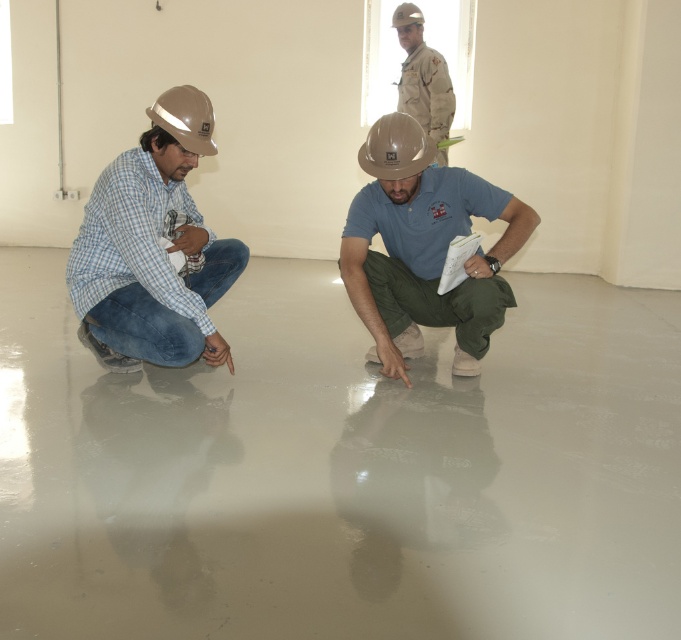
Question: Is matte blue shirt at left below camouflage uniform at upper center?

Choices:
 (A) no
 (B) yes

Answer: (B)

Question: Is matte brown helmet at center above matte beige helmet at upper center?

Choices:
 (A) yes
 (B) no

Answer: (B)

Question: Which object is farther from the camera taking this photo?

Choices:
 (A) camouflage uniform at upper center
 (B) smooth concrete floor at center
 (C) matte brown helmet at center
 (D) matte beige helmet at upper center

Answer: (D)

Question: From the image, what is the correct spatial relationship of matte blue shirt at left in relation to camouflage uniform at upper center?

Choices:
 (A) left
 (B) right

Answer: (A)

Question: Which point is closer to the camera?

Choices:
 (A) matte blue shirt at left
 (B) smooth concrete floor at center
 (C) camouflage uniform at upper center

Answer: (B)

Question: Which point is farther to the camera?

Choices:
 (A) (409, 120)
 (B) (459, 321)
 (C) (405, 24)

Answer: (C)